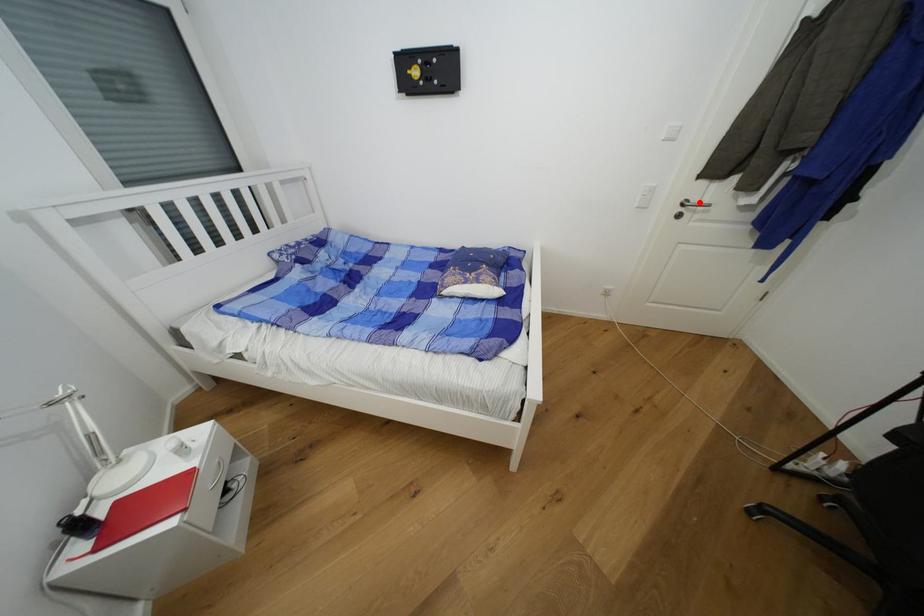
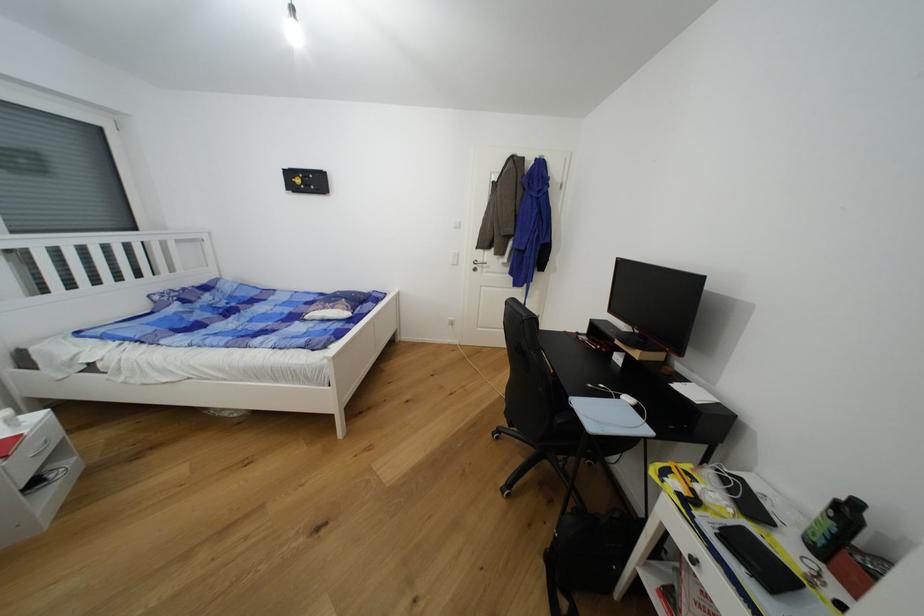
Find the pixel in the second image that matches the highlighted location in the first image.

(484, 262)